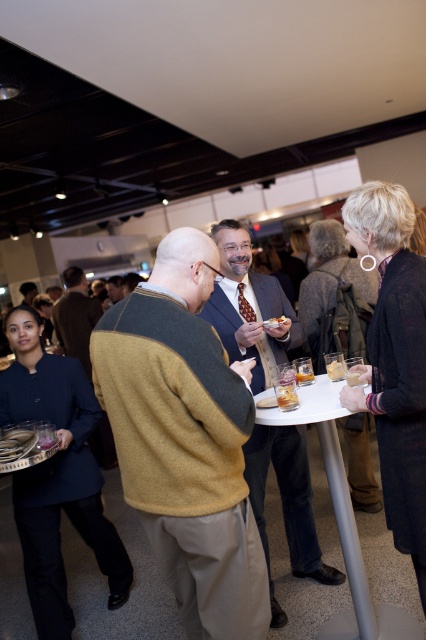
You are standing in the middle of the room and want to walk towards the two points marked in the image. Which point, point [65,337] or point [334,365], will you reach first?

You will reach point [65,337] first because it is closer to you than point [334,365].

You are standing at the entrance of the event venue and see two points in the image. The first point is at coordinate point (221, 314) and the second is at point (365, 371). Which point is closer to you?

Point (221, 314) is further to the camera than point (365, 371), so the second point at (365, 371) is closer to you.